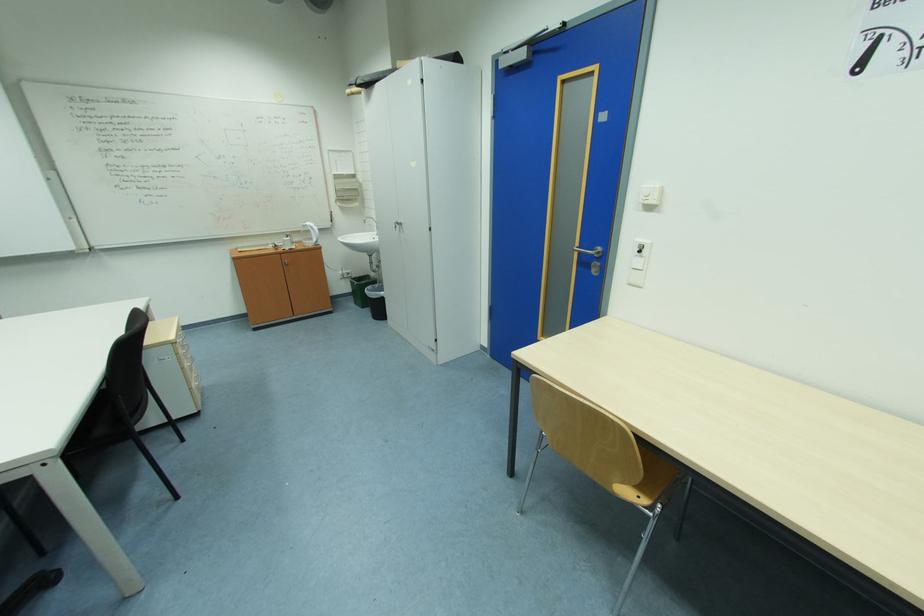
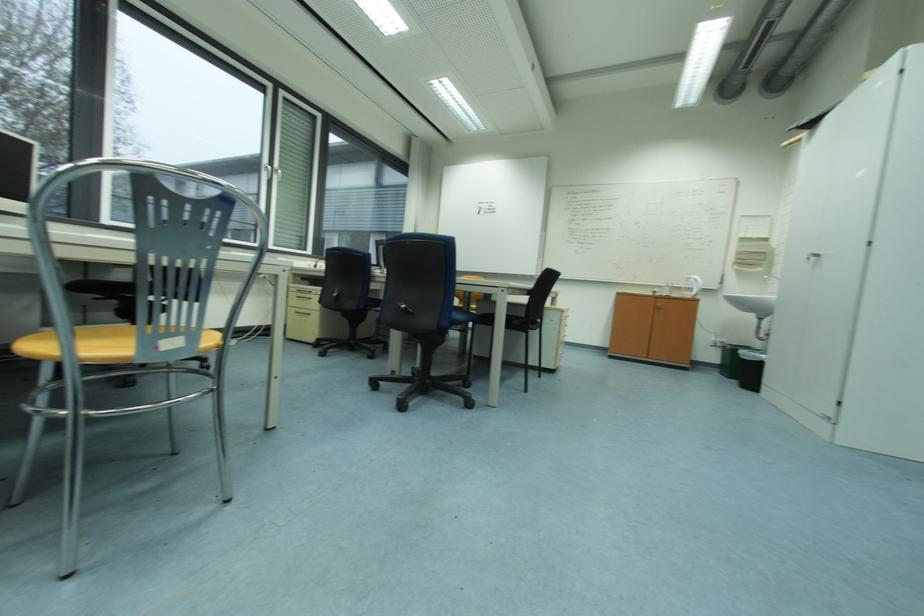
Question: The images are taken continuously from a first-person perspective. In which direction is your viewpoint rotating?

Choices:
 (A) Left
 (B) Right
 (C) Up
 (D) Down

Answer: (A)